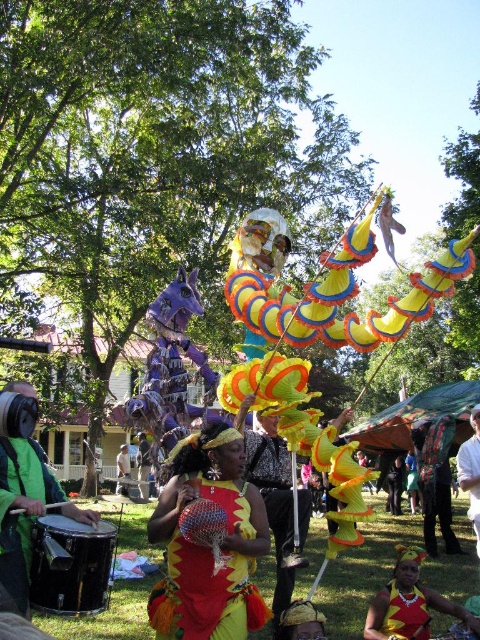
Question: Which point appears closest to the camera in this image?

Choices:
 (A) (476, 540)
 (B) (392, 620)

Answer: (B)

Question: Is the position of yellow fabric headdress at center more distant than that of white cotton shirt at center?

Choices:
 (A) yes
 (B) no

Answer: (B)

Question: Which point is closer to the camera?

Choices:
 (A) (462, 448)
 (B) (22, 508)
 (C) (391, 604)

Answer: (B)

Question: Which of these objects is positioned closest to the yellow fabric headdress at center?

Choices:
 (A) green matte drum at left
 (B) shiny yellow fabric at center

Answer: (B)

Question: Does shiny yellow fabric at center have a greater width compared to yellow fabric headdress at center?

Choices:
 (A) no
 (B) yes

Answer: (A)

Question: Does shiny yellow fabric at center appear over white cotton shirt at center?

Choices:
 (A) yes
 (B) no

Answer: (A)